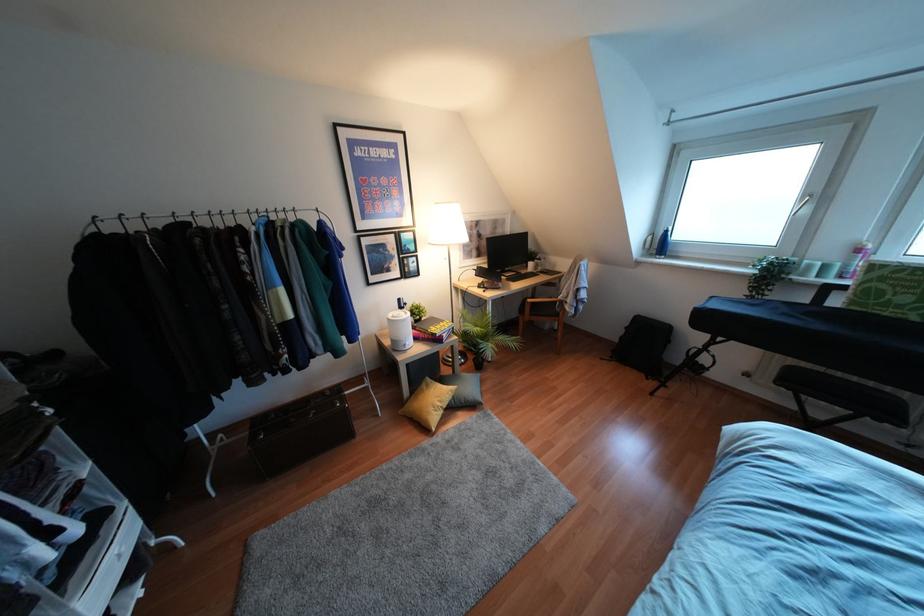
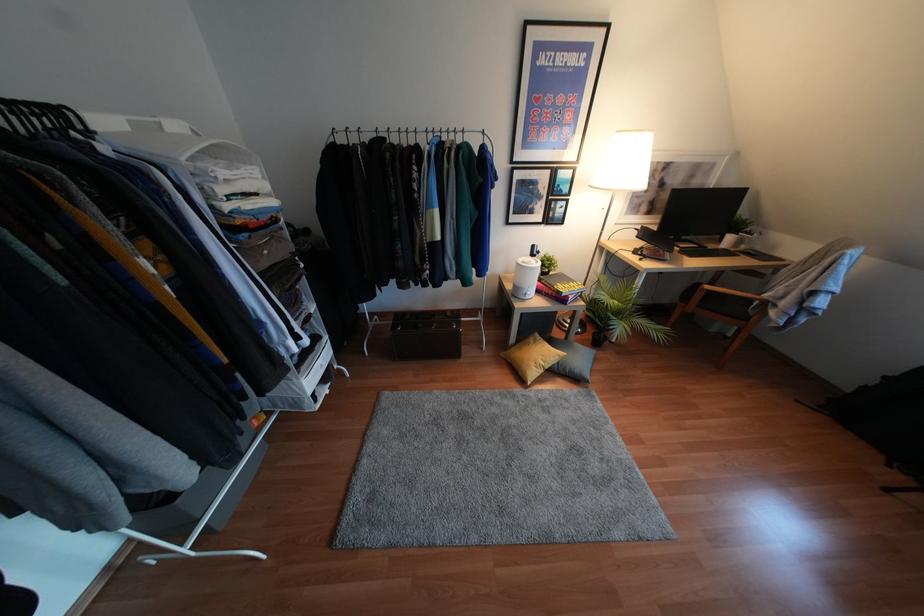
Where in the second image is the point corresponding to (439,403) from the first image?

(541, 363)